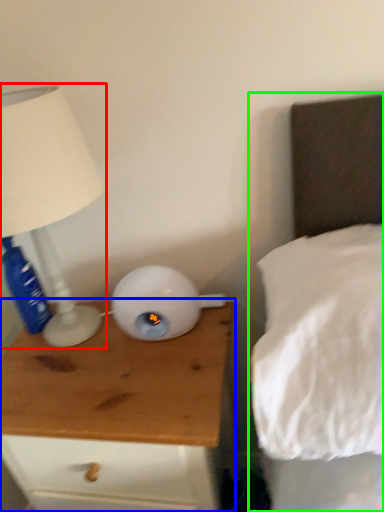
Question: Estimate the real-world distances between objects in this image. Which object is farther from lamp (highlighted by a red box), nightstand (highlighted by a blue box) or bed (highlighted by a green box)?

Choices:
 (A) nightstand
 (B) bed

Answer: (B)